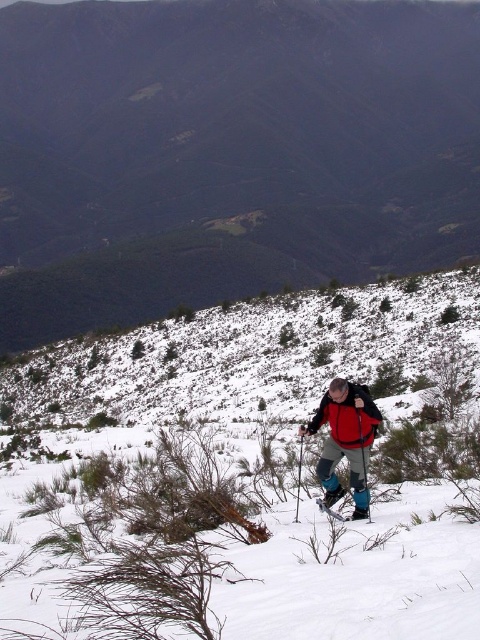
In the scene shown: You are a hiker planning to move from the point at coordinates point (359, 408) to the point at coordinates point (298, 502). Given the mountainous terrain described, which direction should you head to reach your destination?

Since point (359, 408) is closer to the viewer than point (298, 502), you should head away from the viewer to reach your destination.